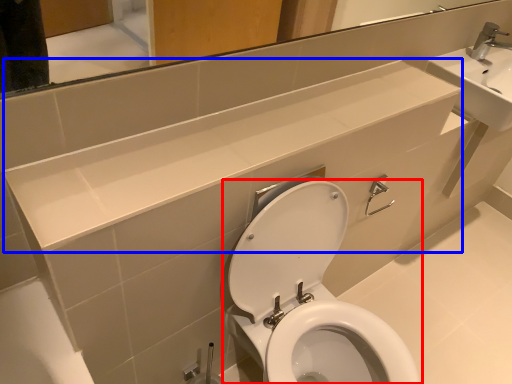
Question: Which object appears farthest to the camera in this image, toilet (highlighted by a red box) or counter top (highlighted by a blue box)?

Choices:
 (A) toilet
 (B) counter top

Answer: (A)